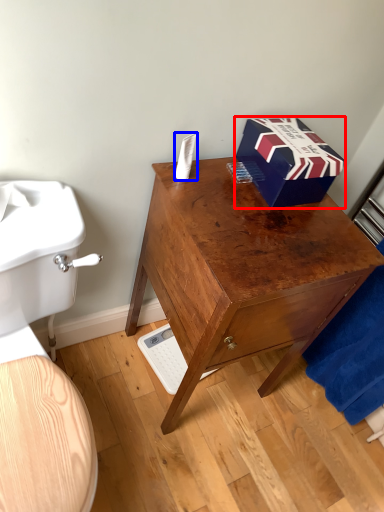
Question: Among these objects, which one is farthest to the camera, box (highlighted by a red box) or toilet paper (highlighted by a blue box)?

Choices:
 (A) box
 (B) toilet paper

Answer: (B)